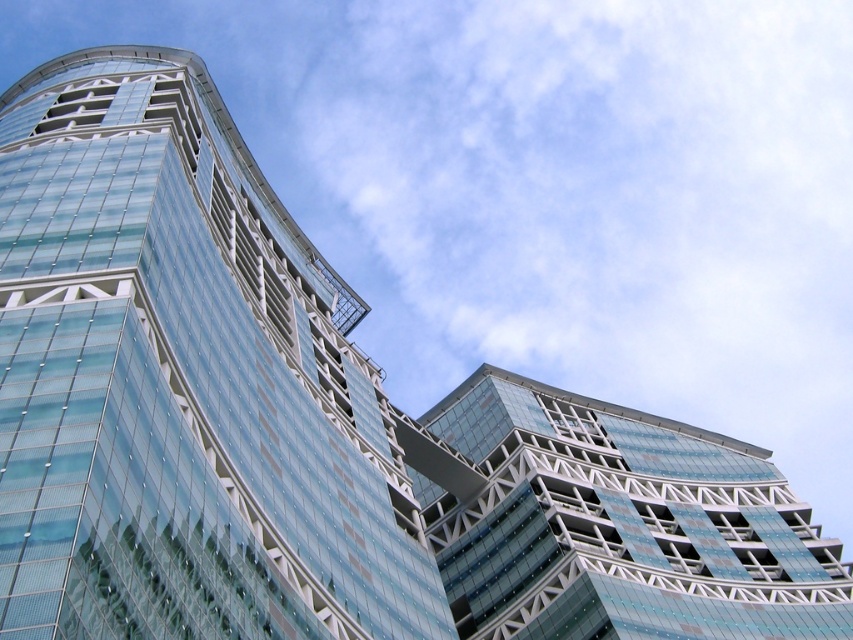
You are an architect evaluating the design of the transparent glass building at center and the transparent glass building at upper right. Which one would you say is bigger in size?

The transparent glass building at center has a larger size compared to the transparent glass building at upper right, so the transparent glass building at center is bigger.

You are standing at the base of the modern highrise building and notice two points marked on the glass facade. The first point is located at coordinates point (0, 109) and the second at point (488, 449). From your vantage point, which point appears closer to you?

Point (0, 109) is in front of point (488, 449), so it appears closer to you.